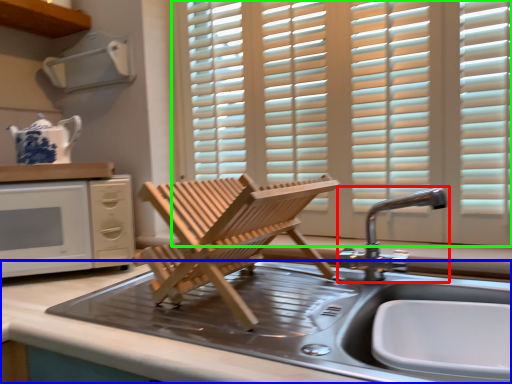
Question: Which object is the closest to the tap (highlighted by a red box)? Choose among these: countertop (highlighted by a blue box) or window (highlighted by a green box).

Choices:
 (A) countertop
 (B) window

Answer: (A)